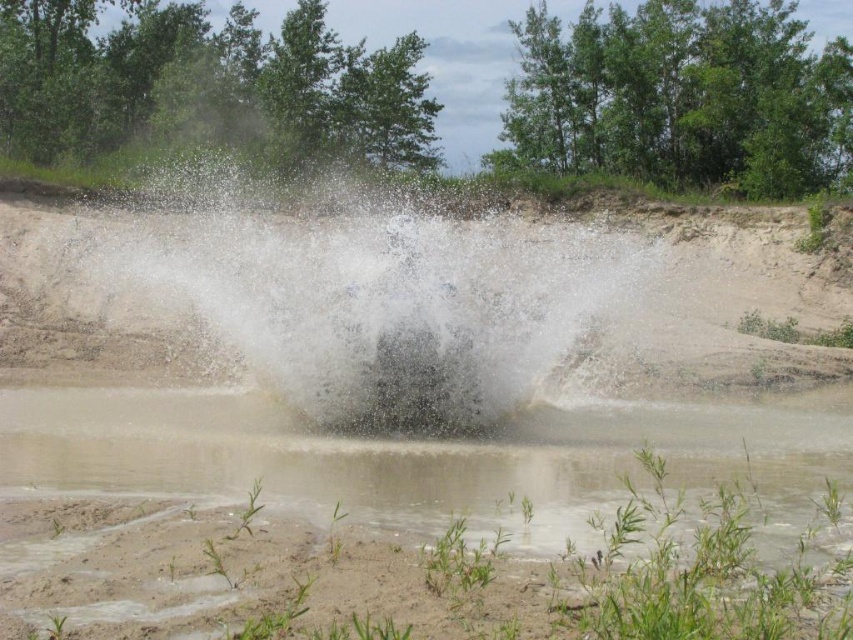
Is muddy water at center above white frothy water at center?

Actually, muddy water at center is below white frothy water at center.

Does muddy water at center lie behind white frothy water at center?

No, it is not.

Where is `muddy water at center`? The height and width of the screenshot is (640, 853). muddy water at center is located at coordinates (433, 460).